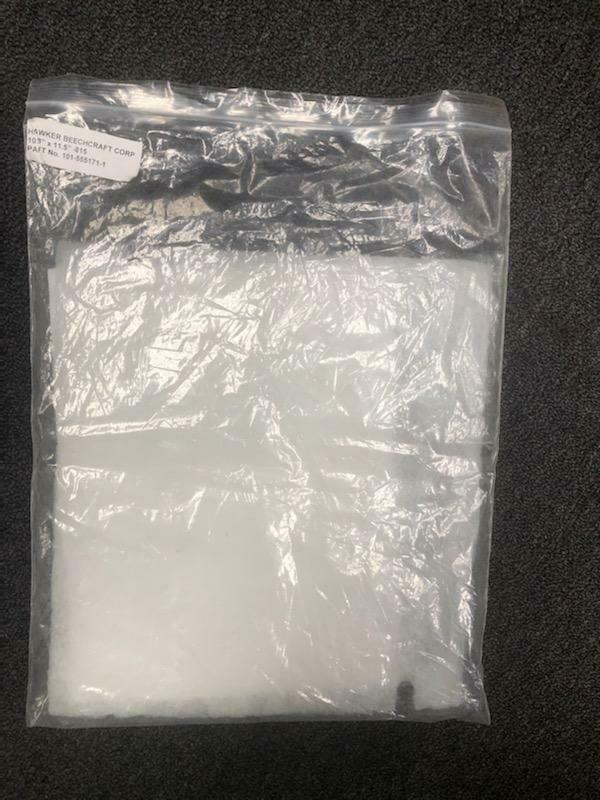
This screenshot has height=800, width=600. Find the location of `sticker`. sticker is located at coordinates (77, 149).